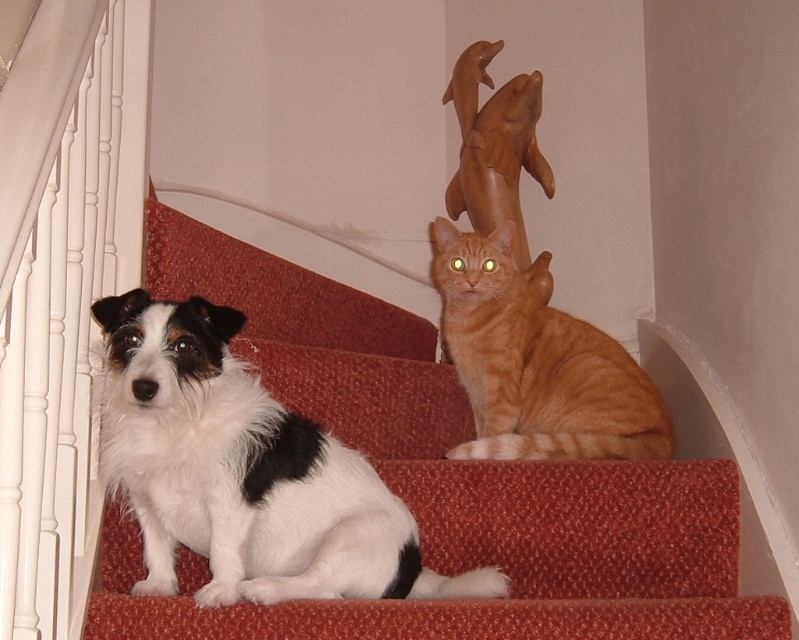
Question: Considering the relative positions of white painted wood at left and white-furred dog at lower left in the image provided, where is white painted wood at left located with respect to white-furred dog at lower left?

Choices:
 (A) right
 (B) left

Answer: (B)

Question: Does carpeted stairs at center appear under white painted wood at left?

Choices:
 (A) no
 (B) yes

Answer: (B)

Question: Among these objects, which one is farthest from the camera?

Choices:
 (A) orange tabby cat at upper center
 (B) white painted wood at left
 (C) white-furred dog at lower left
 (D) carpeted stairs at center

Answer: (A)

Question: Does white painted wood at left appear on the right side of orange tabby cat at upper center?

Choices:
 (A) no
 (B) yes

Answer: (A)

Question: Which object is positioned farthest from the white painted wood at left?

Choices:
 (A) carpeted stairs at center
 (B) white-furred dog at lower left
 (C) orange tabby cat at upper center

Answer: (C)

Question: Which object appears farthest from the camera in this image?

Choices:
 (A) white-furred dog at lower left
 (B) orange tabby cat at upper center

Answer: (B)